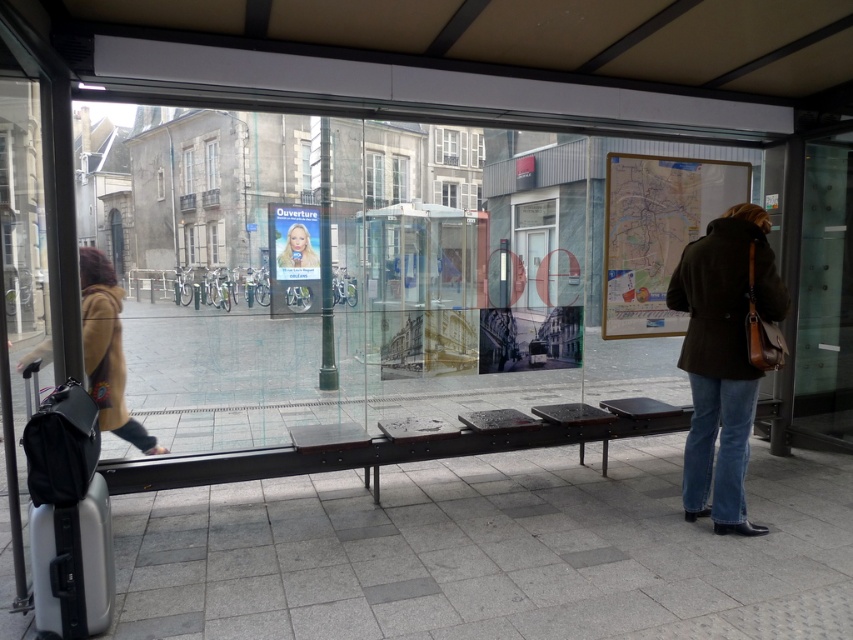
Question: Among these points, which one is farthest from the camera?

Choices:
 (A) (45, 547)
 (B) (212, 148)

Answer: (B)

Question: In this image, where is blonde hair at center located relative to transparent glass window at center?

Choices:
 (A) below
 (B) above

Answer: (A)

Question: Considering the relative positions of silver metallic suitcase at lower left and transparent glass window at center in the image provided, where is silver metallic suitcase at lower left located with respect to transparent glass window at center?

Choices:
 (A) above
 (B) below

Answer: (B)

Question: Is transparent glass door at right below transparent glass window at center?

Choices:
 (A) no
 (B) yes

Answer: (B)

Question: Which of the following is the farthest from the observer?

Choices:
 (A) (708, 504)
 (B) (51, 550)
 (C) (306, 237)
 (D) (218, 182)

Answer: (D)

Question: Which point is closer to the camera?

Choices:
 (A) silver metallic suitcase at lower left
 (B) brown woolen coat at left
 (C) transparent glass window at center

Answer: (A)